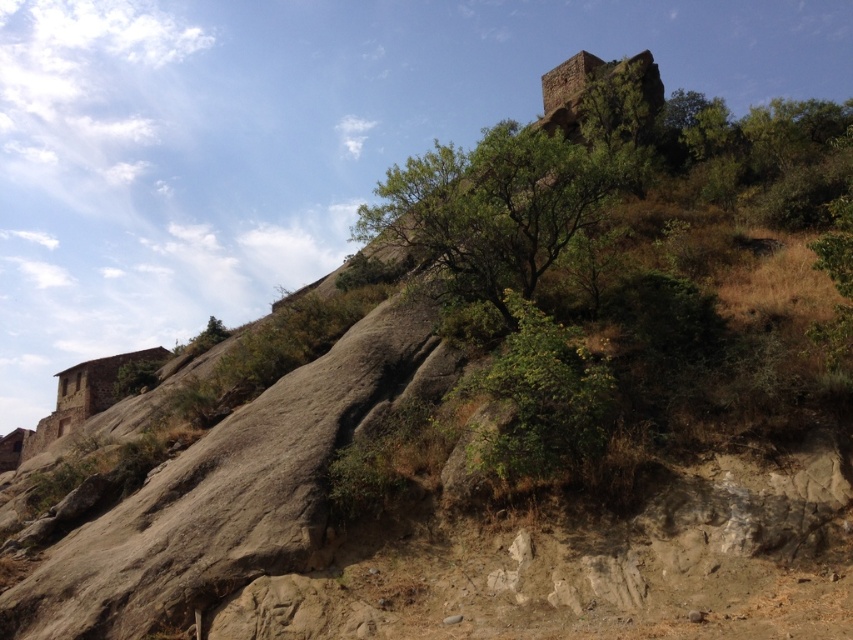
Question: Among these objects, which one is farthest from the camera?

Choices:
 (A) green leafy tree at center
 (B) green leafy bush at center

Answer: (A)

Question: Can you confirm if green leafy tree at center is positioned above green leafy bush at center?

Choices:
 (A) yes
 (B) no

Answer: (A)

Question: Is the position of green leafy tree at center more distant than that of green leafy bush at center?

Choices:
 (A) no
 (B) yes

Answer: (B)

Question: Which of the following is the farthest from the observer?

Choices:
 (A) (506, 296)
 (B) (505, 179)

Answer: (B)

Question: Can you confirm if green leafy tree at center is smaller than green leafy bush at center?

Choices:
 (A) no
 (B) yes

Answer: (A)